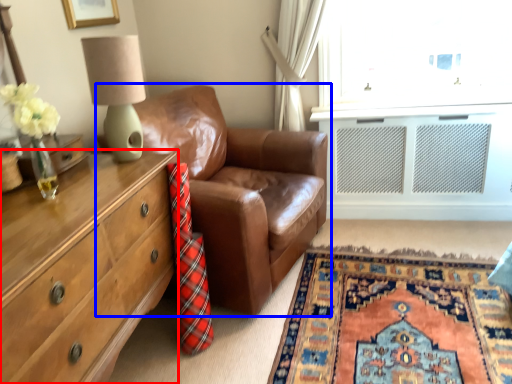
Question: Which object appears closest to the camera in this image, chest of drawers (highlighted by a red box) or studio couch (highlighted by a blue box)?

Choices:
 (A) chest of drawers
 (B) studio couch

Answer: (A)